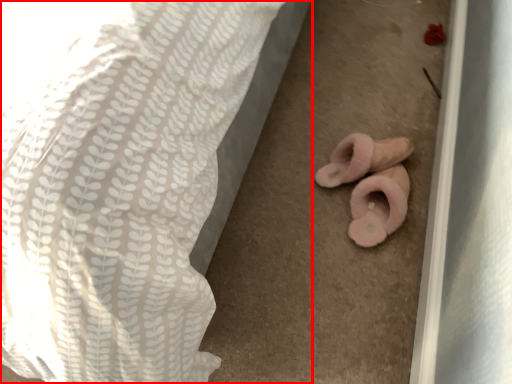
Question: In this image, where is bed (annotated by the red box) located relative to stuff?

Choices:
 (A) left
 (B) right

Answer: (A)